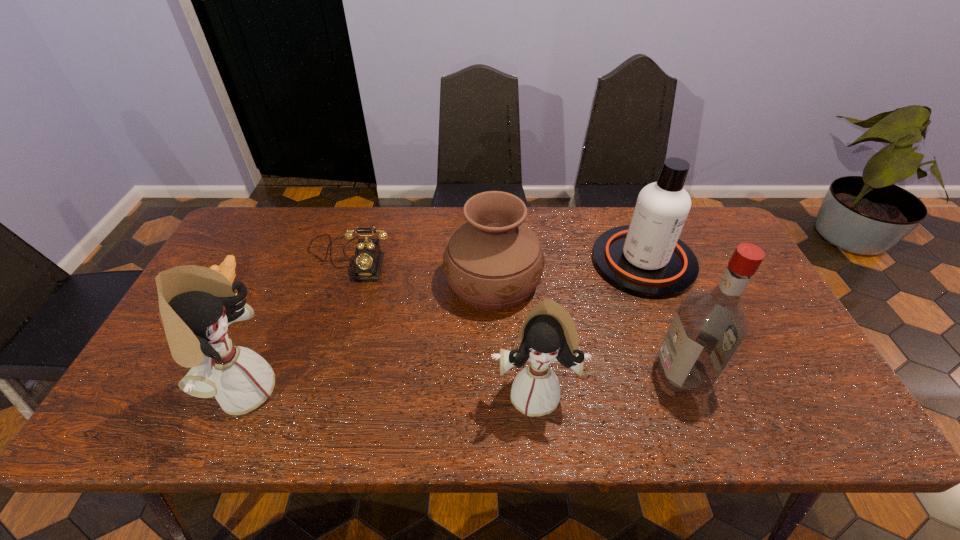
The height and width of the screenshot is (540, 960). Identify the location of vacant region located on the dial of the sixth tallest object. (325, 332).

Where is `vacant area located on the right of the third shortest object`? vacant area located on the right of the third shortest object is located at coordinates (604, 281).

In order to click on vacant region located on the face of the leftmost object in this screenshot , I will do `click(194, 343)`.

The width and height of the screenshot is (960, 540). Find the location of `free region located on the front-facing side of the liquor`. free region located on the front-facing side of the liquor is located at coordinates (499, 374).

Where is `blank space located 0.110m on the front-facing side of the liquor`? This screenshot has width=960, height=540. blank space located 0.110m on the front-facing side of the liquor is located at coordinates (612, 374).

Locate an element on the screen. Image resolution: width=960 pixels, height=540 pixels. vacant space located on the front-facing side of the liquor is located at coordinates pyautogui.click(x=553, y=374).

This screenshot has height=540, width=960. In order to click on cleansing agent that is at the far edge in this screenshot , I will do `click(646, 259)`.

Locate an element on the screen. telephone that is at the far edge is located at coordinates (368, 259).

The height and width of the screenshot is (540, 960). I want to click on urn that is at the far edge, so click(493, 261).

I want to click on liquor situated at the near edge, so click(708, 328).